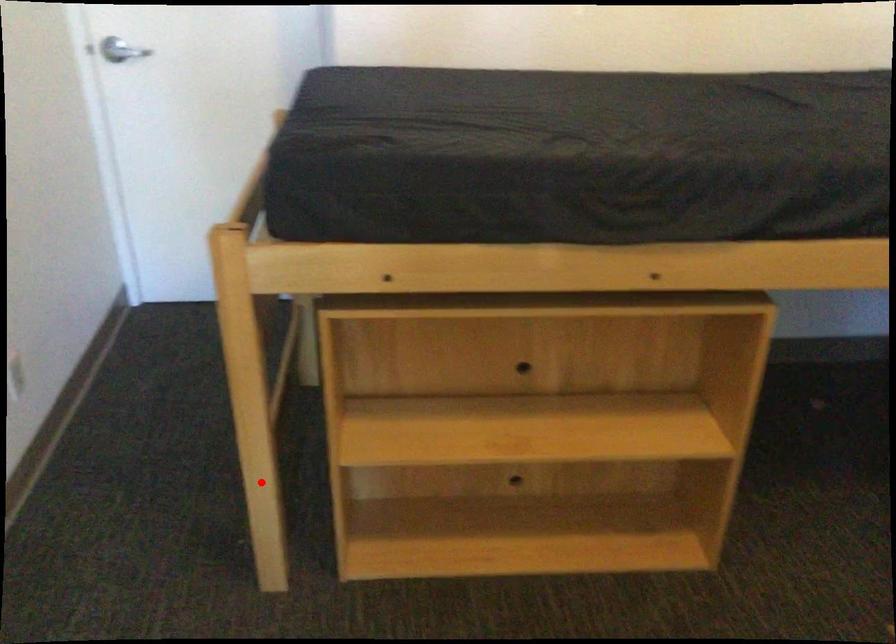
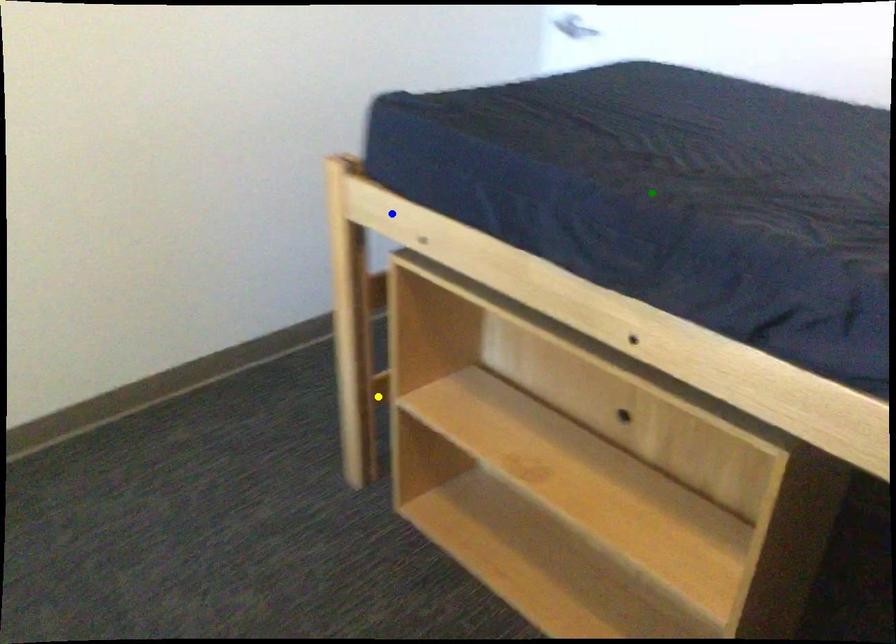
Question: I am providing you with two images of the same scene from different viewpoints. A red point is marked on the first image. You are given multiple points on the second image. Which point in image 2 is actually the same real-world point as the red point in image 1?

Choices:
 (A) yellow point
 (B) green point
 (C) blue point

Answer: (A)